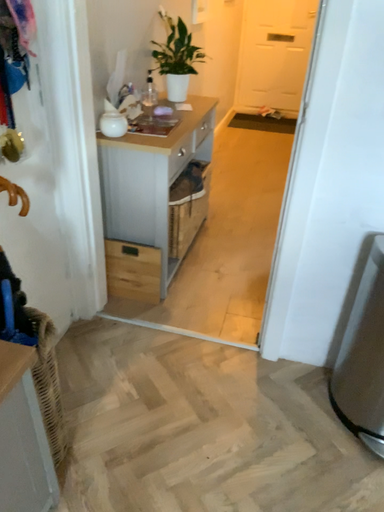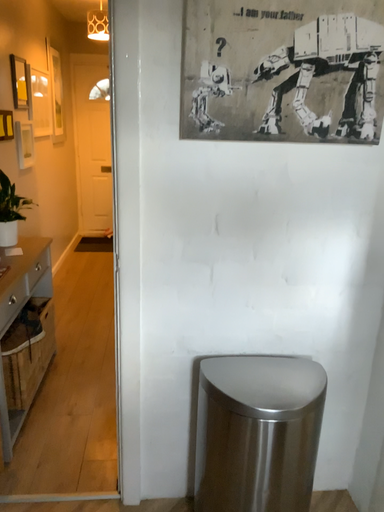
Question: Which way did the camera rotate in the video?

Choices:
 (A) rotated left
 (B) rotated right

Answer: (B)